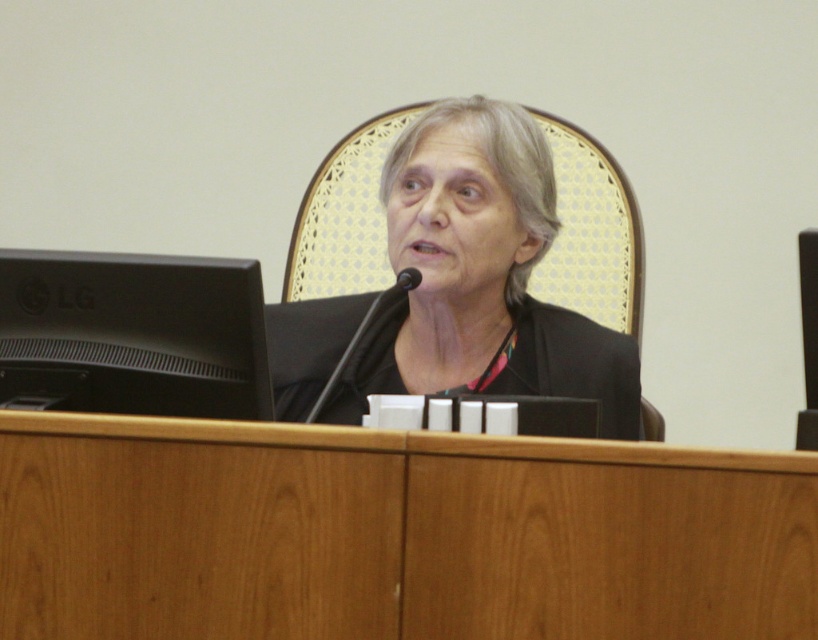
Can you confirm if black matte/black fabric at center is positioned to the right of black plastic microphone at center?

Indeed, black matte/black fabric at center is positioned on the right side of black plastic microphone at center.

Does point (365, 132) come in front of point (392, 292)?

No, (365, 132) is behind (392, 292).

Is point (461, 157) closer to camera compared to point (353, 339)?

That is False.

The image size is (818, 640). I want to click on black matte/black fabric at center, so click(x=497, y=243).

Is point (218, 412) less distant than point (317, 412)?

Yes, it is.

Is black matte monitor at left bigger than black plastic microphone at center?

No.

Which is in front, point (201, 336) or point (369, 323)?

Positioned in front is point (201, 336).

Where is `black matte monitor at left`? black matte monitor at left is located at coordinates (133, 333).

Is the position of black matte/black fabric at center more distant than that of black matte monitor at left?

Yes, it is.

Between point (612, 371) and point (120, 307), which one is positioned behind?

Positioned behind is point (612, 371).

Locate an element on the screen. The height and width of the screenshot is (640, 818). black matte/black fabric at center is located at coordinates (497, 243).

The height and width of the screenshot is (640, 818). What are the coordinates of `black matte/black fabric at center` in the screenshot? It's located at (497, 243).